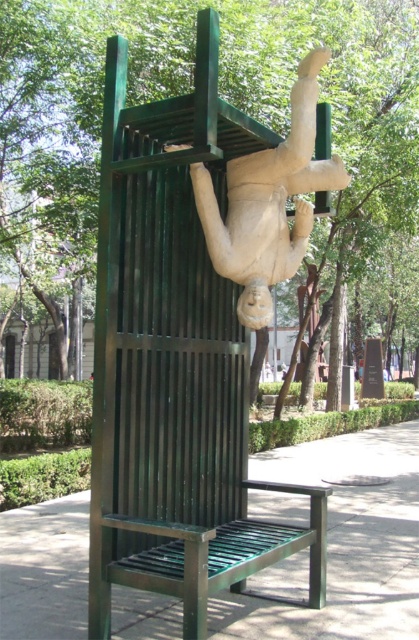
Question: Which object appears closest to the camera in this image?

Choices:
 (A) white stone figure at upper center
 (B) green metal bench at center
 (C) green metallic tree at upper center

Answer: (A)

Question: Observing the image, what is the correct spatial positioning of green metallic tree at upper center in reference to white stone figure at upper center?

Choices:
 (A) left
 (B) right

Answer: (A)

Question: Considering the real-world distances, which object is farthest from the white stone figure at upper center?

Choices:
 (A) green metallic tree at upper center
 (B) green metal bench at center

Answer: (A)

Question: Considering the relative positions of green metallic tree at upper center and green metal bench at center in the image provided, where is green metallic tree at upper center located with respect to green metal bench at center?

Choices:
 (A) above
 (B) below

Answer: (A)

Question: Does green metallic tree at upper center have a lesser width compared to white stone figure at upper center?

Choices:
 (A) yes
 (B) no

Answer: (B)

Question: Which point is closer to the camera?

Choices:
 (A) green metal bench at center
 (B) green metallic tree at upper center
 (C) white stone figure at upper center

Answer: (C)